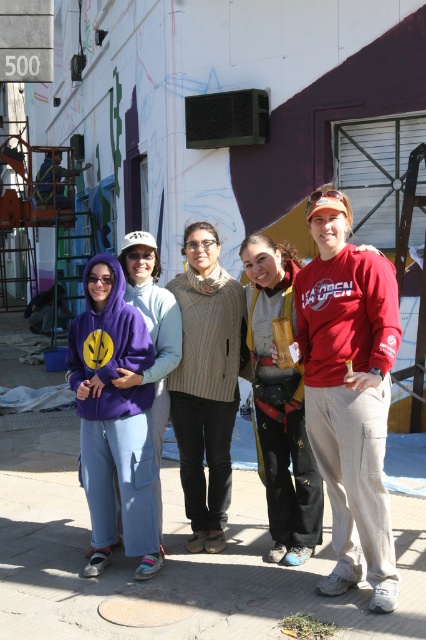
You are a photographer trying to capture a group photo of the purple fleece hoodie at left and the matte yellow vest at center. Since you want to ensure both subjects are fully visible, which subject should you frame first to accommodate their larger size?

The purple fleece hoodie at left should be framed first because its width surpasses that of the matte yellow vest at center, ensuring there is enough space for the larger subject.

You are a photographer setting up a camera to capture the group photo of the purple fleece hoodie at left and matte yellow vest at center. The camera has a minimum focus distance of 30 inches. Will you be able to focus on both subjects without moving the camera?

The distance between the purple fleece hoodie at left and matte yellow vest at center is 33.40 inches, which is greater than the camera minimum focus distance of 30 inches. Therefore, the camera can focus on both subjects without moving.